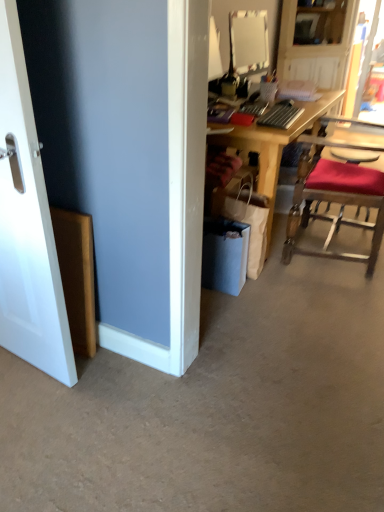
Question: Is gray carpet at lower center thinner than white smooth door at left?

Choices:
 (A) yes
 (B) no

Answer: (B)

Question: From a real-world perspective, is gray carpet at lower center on top of white smooth door at left?

Choices:
 (A) yes
 (B) no

Answer: (B)

Question: Does gray carpet at lower center have a greater width compared to white smooth door at left?

Choices:
 (A) no
 (B) yes

Answer: (B)

Question: Can you confirm if gray carpet at lower center is smaller than white smooth door at left?

Choices:
 (A) yes
 (B) no

Answer: (B)

Question: Is gray carpet at lower center with white smooth door at left?

Choices:
 (A) no
 (B) yes

Answer: (A)

Question: In terms of size, does wooden desk at upper right appear bigger or smaller than wooden desk at center?

Choices:
 (A) small
 (B) big

Answer: (A)

Question: Looking at their shapes, would you say wooden desk at upper right is wider or thinner than wooden desk at center?

Choices:
 (A) wide
 (B) thin

Answer: (B)

Question: Is wooden desk at upper right situated inside wooden desk at center or outside?

Choices:
 (A) outside
 (B) inside

Answer: (A)

Question: Is wooden desk at upper right to the left or to the right of wooden desk at center in the image?

Choices:
 (A) left
 (B) right

Answer: (B)

Question: From the image's perspective, relative to white smooth door at left, is gray carpet at lower center above or below?

Choices:
 (A) below
 (B) above

Answer: (A)

Question: Do you think gray carpet at lower center is within white smooth door at left, or outside of it?

Choices:
 (A) inside
 (B) outside

Answer: (B)

Question: Is point (61, 465) closer or farther from the camera than point (41, 202)?

Choices:
 (A) farther
 (B) closer

Answer: (A)

Question: Is gray carpet at lower center bigger or smaller than white smooth door at left?

Choices:
 (A) small
 (B) big

Answer: (B)

Question: Is wooden chair with red cushion at right spatially inside wooden desk at center, or outside of it?

Choices:
 (A) outside
 (B) inside

Answer: (A)

Question: Considering the positions of wooden chair with red cushion at right and wooden desk at center in the image, is wooden chair with red cushion at right bigger or smaller than wooden desk at center?

Choices:
 (A) small
 (B) big

Answer: (A)